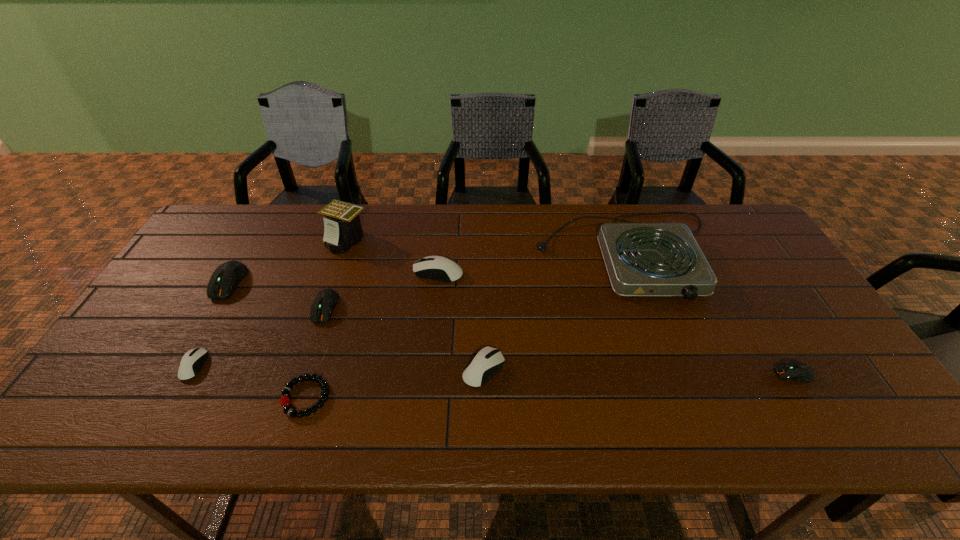
The width and height of the screenshot is (960, 540). In order to click on free space that is in between the leftmost dark computer equipment and the second computer equipment from right to left in this screenshot , I will do `click(356, 326)`.

The image size is (960, 540). Find the location of `vacant space that's between the farthest white mouse and the second biggest dark computer equipment`. vacant space that's between the farthest white mouse and the second biggest dark computer equipment is located at coordinates (382, 290).

This screenshot has width=960, height=540. In order to click on free spot between the second biggest dark computer equipment and the fourth object from right to left in this screenshot , I will do `click(382, 290)`.

You are a GUI agent. You are given a task and a screenshot of the screen. Output one action in this format:
    pyautogui.click(x=<x>, y=<y>)
    Task: Click on the vacant area that lies between the rightmost dark computer equipment and the sixth object from left to right
    This screenshot has width=960, height=540.
    Given the screenshot: What is the action you would take?
    616,323

In order to click on vacant area between the calculator and the fifth computer equipment from left to right in this screenshot , I will do `click(416, 305)`.

You are a GUI agent. You are given a task and a screenshot of the screen. Output one action in this format:
    pyautogui.click(x=<x>, y=<y>)
    Task: Click on the vacant point located between the rightmost dark computer equipment and the shortest object
    
    Given the screenshot: What is the action you would take?
    pyautogui.click(x=550, y=386)

Locate an element on the screen. blank region between the third computer equipment from right to left and the bracelet is located at coordinates (372, 335).

Identify which object is the eighth nearest to the second tallest object. Please provide its 2D coordinates. Your answer should be formatted as a tuple, i.e. [(x, y)], where the tuple contains the x and y coordinates of a point satisfying the conditions above.

[(224, 280)]

Identify which object is the seventh nearest to the rightmost dark computer equipment. Please provide its 2D coordinates. Your answer should be formatted as a tuple, i.e. [(x, y)], where the tuple contains the x and y coordinates of a point satisfying the conditions above.

[(192, 361)]

Find the location of `the closest computer equipment to the third object from right to left`. the closest computer equipment to the third object from right to left is located at coordinates point(439,268).